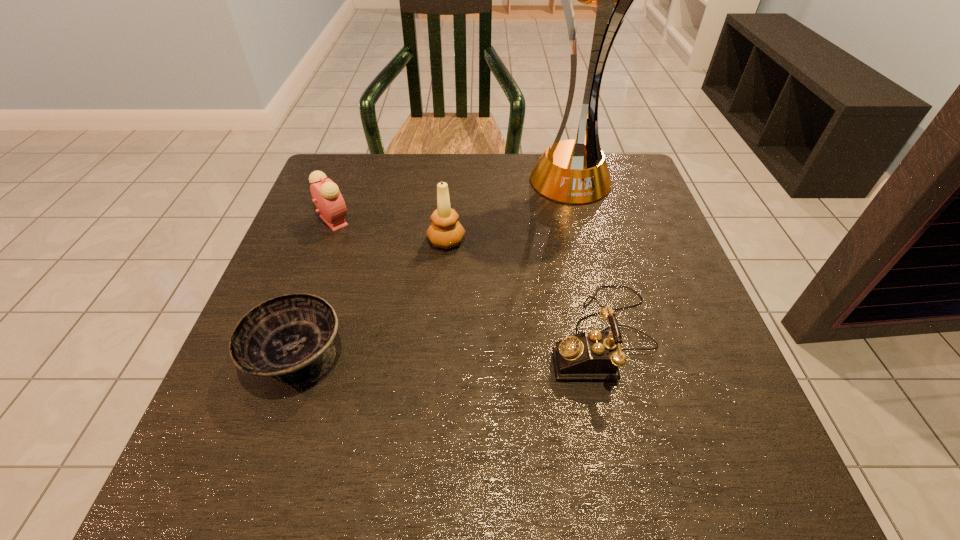
You are a GUI agent. You are given a task and a screenshot of the screen. Output one action in this format:
    pyautogui.click(x=<x>, y=<y>)
    Task: Click on the free spot between the tallest object and the alarm clock
    This screenshot has height=540, width=960.
    Given the screenshot: What is the action you would take?
    pyautogui.click(x=451, y=200)

At what (x,y) coordinates should I click in order to perform the action: click on blank region between the bowl and the trophy. Please return your answer as a coordinate pair (x, y). The width and height of the screenshot is (960, 540). Looking at the image, I should click on 433,268.

Find the location of a particular element. free space between the bowl and the telephone is located at coordinates (450, 346).

The image size is (960, 540). In order to click on vacant space that's between the candle_holder and the shortest object in this screenshot , I will do `click(372, 299)`.

In order to click on free point between the telephone and the alarm clock in this screenshot , I will do `click(468, 278)`.

This screenshot has width=960, height=540. I want to click on vacant area that lies between the shortest object and the telephone, so coord(450,346).

Locate an element on the screen. Image resolution: width=960 pixels, height=540 pixels. vacant area that lies between the telephone and the bowl is located at coordinates (450, 346).

Identify the location of vacant space that is in between the trophy and the third object from right to left. The image size is (960, 540). (508, 210).

This screenshot has width=960, height=540. Find the location of `object that stands as the third closest to the shortest object`. object that stands as the third closest to the shortest object is located at coordinates (591, 355).

The image size is (960, 540). Identify the location of the fourth closest object to the farthest object. (289, 338).